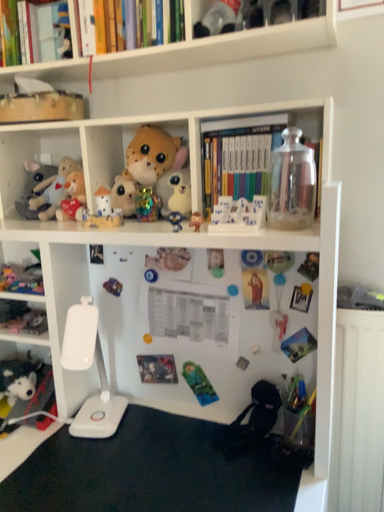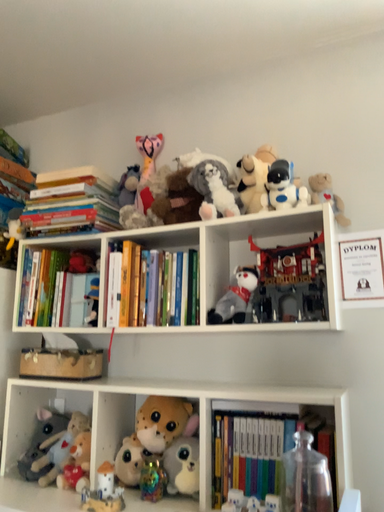
Question: Which way did the camera rotate in the video?

Choices:
 (A) rotated downward
 (B) rotated upward

Answer: (B)